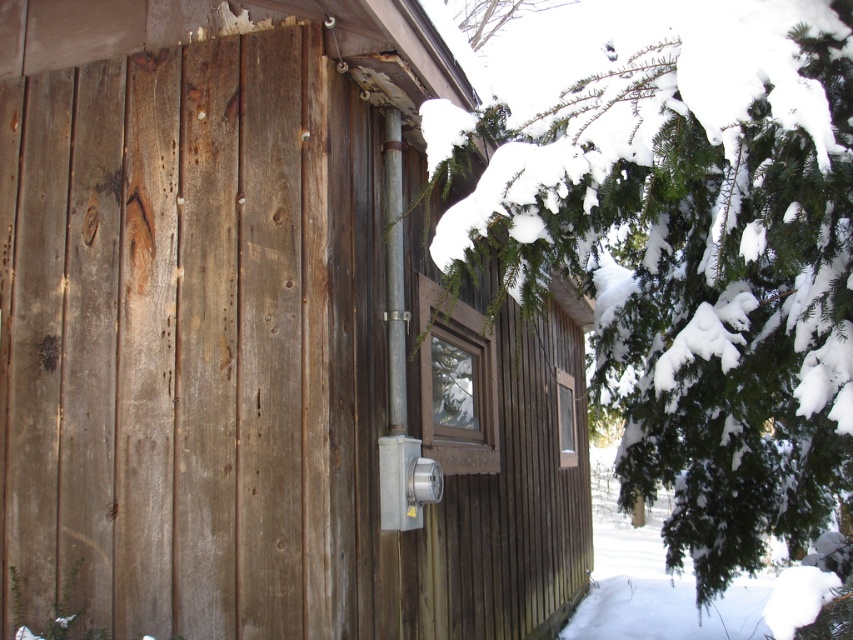
You are standing in front of the weathered wood cabin at center and the green textured pine tree at upper right. Which one is taller?

The weathered wood cabin at center is much taller than the green textured pine tree at upper right.

You are standing at the base of the green textured pine tree at upper right and want to reach the weathered wood cabin at center. Given that your stride length is 2.5 feet per step, how many steps will it take you to walk directly to the cabin?

The distance between the weathered wood cabin at center and the green textured pine tree at upper right is 9.03 feet. Since each step covers 2.5 feet, dividing 9.03 by 2.5 gives approximately 3.61 steps. Rounding up, it would take about 4 steps to reach the cabin.

You are standing in front of the weathered wood cabin at center and the green textured pine tree at upper right. Which object takes up more space in the image?

The weathered wood cabin at center is bigger than the green textured pine tree at upper right, so it takes up more space in the image.